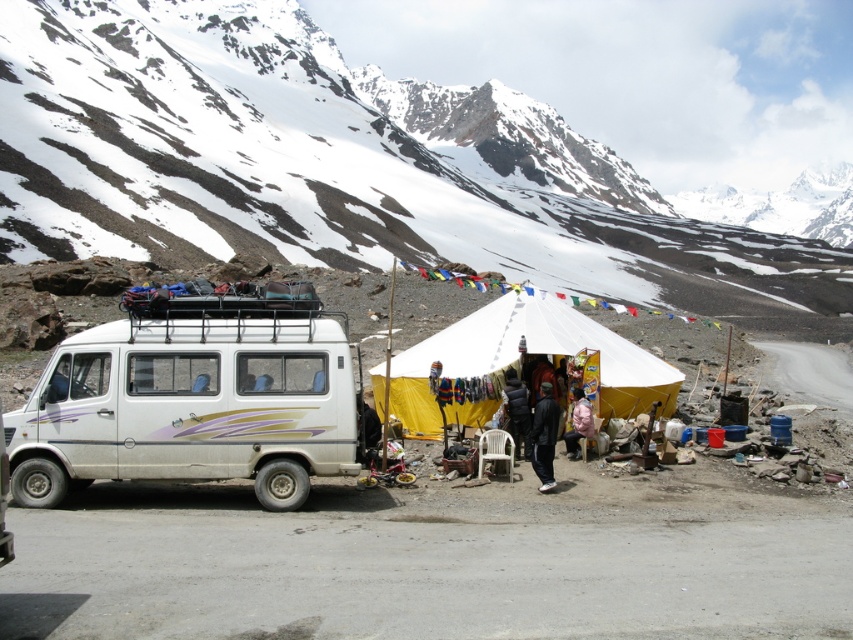
Question: Where is white snow-covered mountain at upper center located in relation to black fuzzy jacket at center in the image?

Choices:
 (A) left
 (B) right

Answer: (B)

Question: Which object is closer to the camera taking this photo?

Choices:
 (A) pink fabric person at center
 (B) white matte van at left
 (C) white snow-covered mountain at upper center
 (D) black leather jacket at center

Answer: (B)

Question: Is the position of black leather jacket at center less distant than that of pink fabric person at center?

Choices:
 (A) yes
 (B) no

Answer: (A)

Question: Which of the following is the farthest from the observer?

Choices:
 (A) (573, 444)
 (B) (404, 412)
 (C) (521, 435)
 (D) (218, 168)

Answer: (D)

Question: In this image, where is white canvas tent at center located relative to black leather jacket at center?

Choices:
 (A) left
 (B) right

Answer: (A)

Question: Which of the following is the closest to the observer?

Choices:
 (A) black fuzzy jacket at center
 (B) white canvas tent at center

Answer: (A)